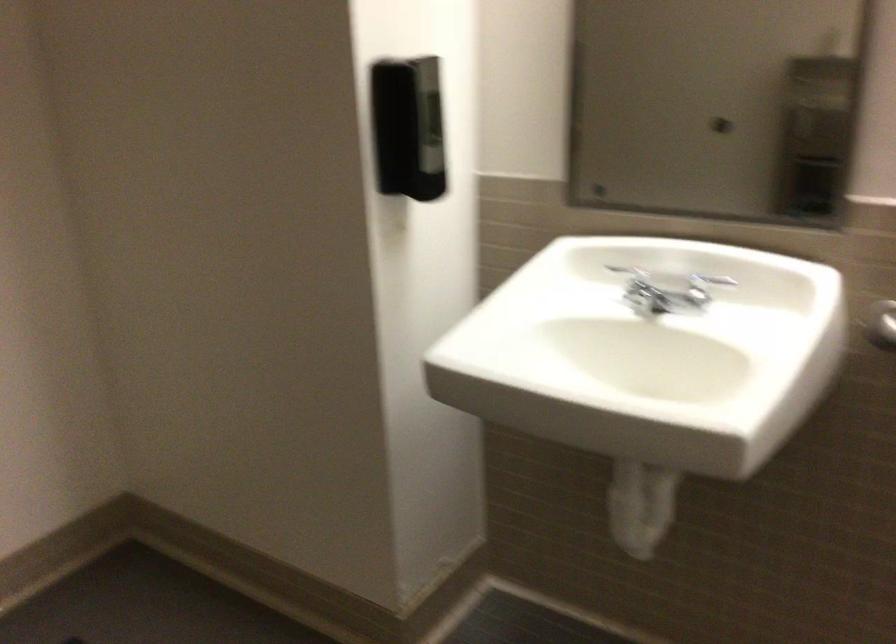
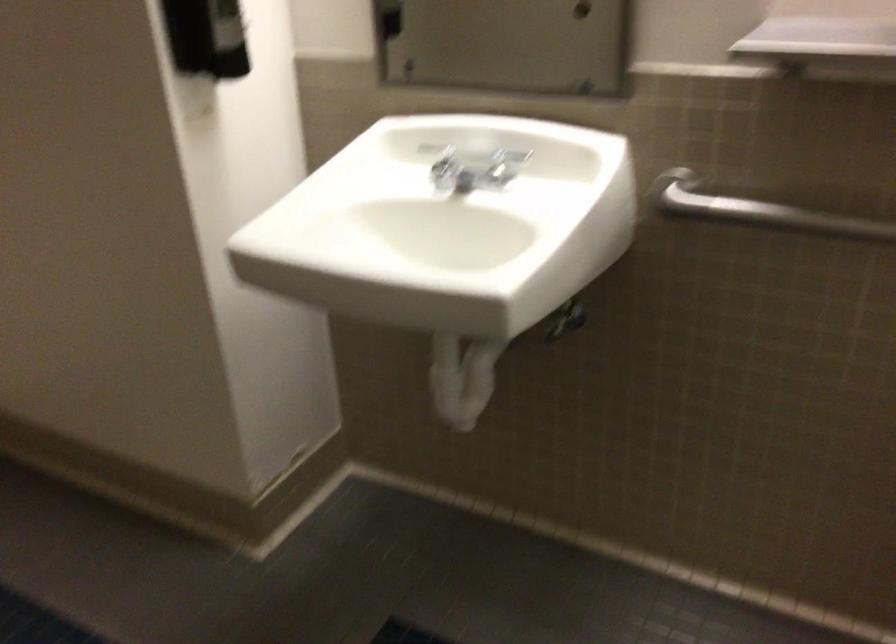
Question: The images are taken continuously from a first-person perspective. In which direction are you moving?

Choices:
 (A) Left
 (B) Right
 (C) Forward
 (D) Backward

Answer: (B)